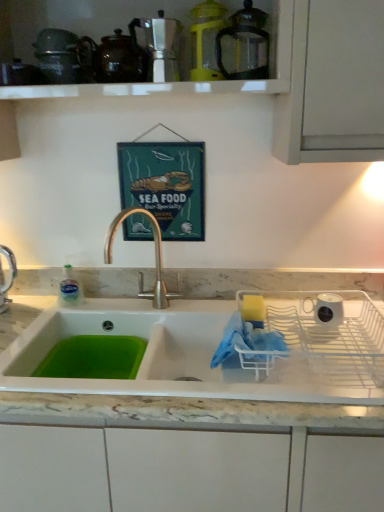
Question: Choose the correct answer: Is brown glossy teapot at upper center inside metallic silver coffee maker at upper center, arranged as the third appliance when viewed from the top, or outside it?

Choices:
 (A) outside
 (B) inside

Answer: (A)

Question: Is point (135, 73) positioned closer to the camera than point (165, 50)?

Choices:
 (A) farther
 (B) closer

Answer: (A)

Question: Which object is the farthest from the yellow plastic blender at upper center, acting as the 2th appliance starting from the left?

Choices:
 (A) white ceramic mug at right, the 1th appliance ordered from the bottom
 (B) metallic silver coffee maker at upper center, placed as the second appliance when sorted from bottom to top
 (C) transparent glass carafe at upper center, which is the third appliance in left-to-right order
 (D) marble at center
 (E) teal wooden signboard at center

Answer: (D)

Question: Estimate the real-world distances between objects in this image. Which object is closer to the marble at center?

Choices:
 (A) transparent glass carafe at upper center, which is the third appliance in left-to-right order
 (B) yellow plastic blender at upper center, acting as the 2th appliance starting from the left
 (C) metallic silver coffee maker at upper center, which ranks as the first appliance in left-to-right order
 (D) teal wooden signboard at center
 (E) white ceramic mug at right, the fourth appliance viewed from the top

Answer: (E)